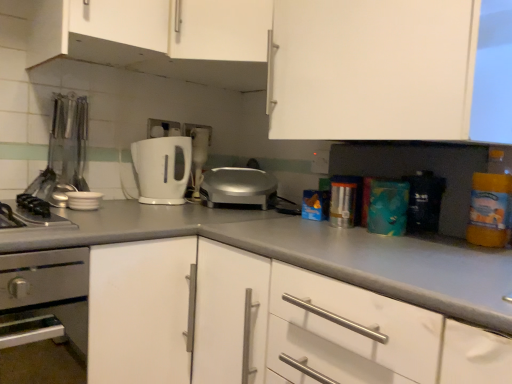
The height and width of the screenshot is (384, 512). I want to click on vacant area that lies in front of white glossy toaster at center, acting as the second toaster starting from the right, so click(146, 204).